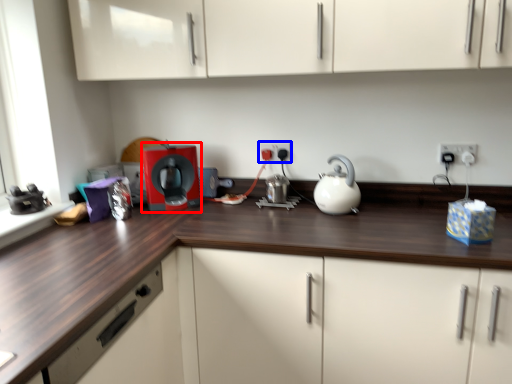
Question: Which object is closer to the camera taking this photo, home appliance (highlighted by a red box) or electric outlet (highlighted by a blue box)?

Choices:
 (A) home appliance
 (B) electric outlet

Answer: (A)